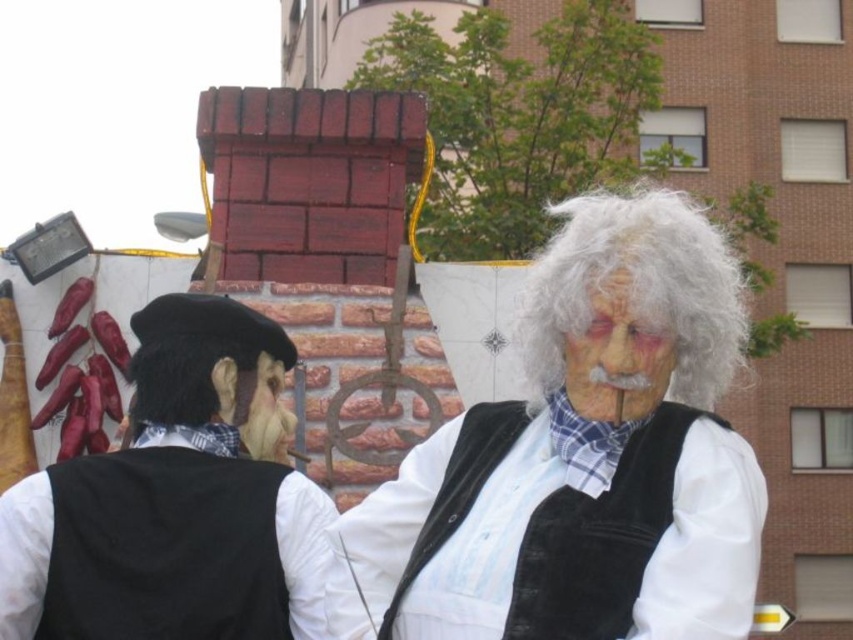
You are a costume designer who needs to adjust the spacing between the white matte vest at center and the velvet vest at center to ensure they are exactly 3 feet apart. Currently, they are 3.37 feet apart. Which vest should you move closer to achieve the desired distance?

The white matte vest at center and velvet vest at center are currently 3.37 feet apart. To reduce the distance to 3 feet, you need to move either vest closer by 0.37 feet. Since both vests are at the center, you can move either one towards the other by that amount to achieve the desired spacing.

You are a costume designer preparing for a play. You need to decide which vest to use for the main character. The main character must wear a vest that is taller than the other. Which vest should you choose between the white matte vest at center and the velvet vest at center?

The white matte vest at center is much taller than the velvet vest at center, so you should choose the white matte vest at center for the main character.